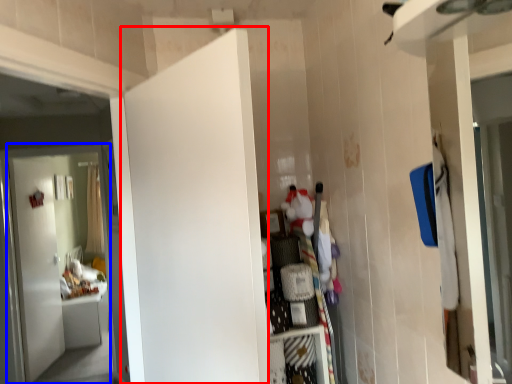
Question: Which object appears farthest to the camera in this image, door (highlighted by a red box) or door (highlighted by a blue box)?

Choices:
 (A) door
 (B) door

Answer: (B)